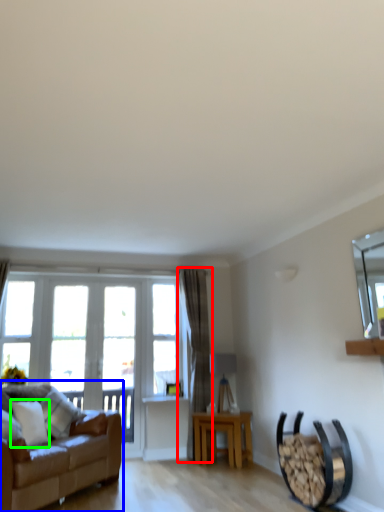
Question: Which is nearer to the curtain (highlighted by a red box)? studio couch (highlighted by a blue box) or pillow (highlighted by a green box).

Choices:
 (A) studio couch
 (B) pillow

Answer: (A)